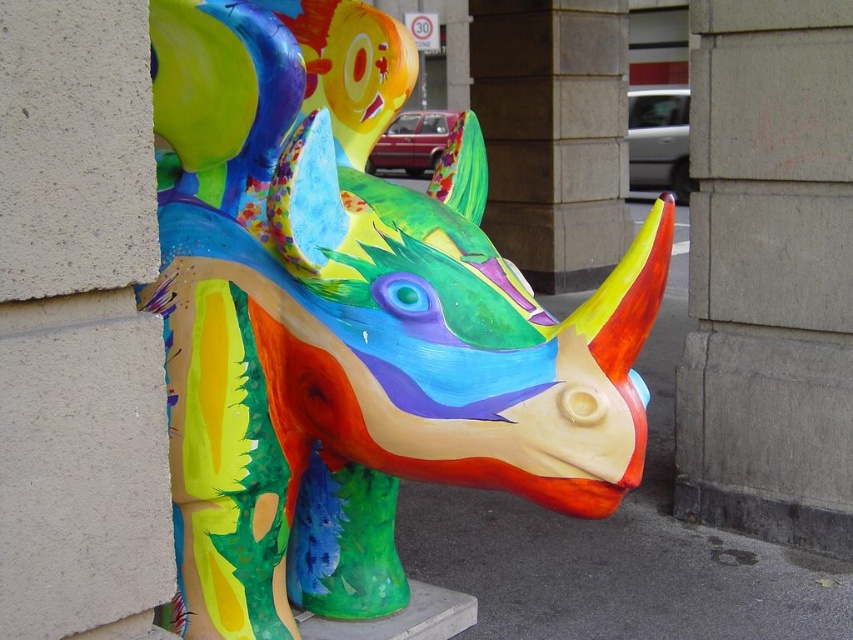
You are standing in front of the sculpture and want to take a photo of the multicolored painted rhinoceros at center and the gray concrete pillar at center. Which object is positioned to the left side of the other?

The multicolored painted rhinoceros at center is to the left of the gray concrete pillar at center.

You are an art student standing in front of the multicolored painted rhinoceros at center and the gray concrete pillar at center. Which object is nearer to you?

The multicolored painted rhinoceros at center is closer to the viewer than the gray concrete pillar at center.

You are standing in front of the sculpture of the rhinoceros. There are two points marked on it. One is at coordinate point [247,317] and the other at point [793,113]. From your perspective, which point is closer to you?

Point [247,317] is in front of point [793,113], so the point at [247,317] is closer to you.